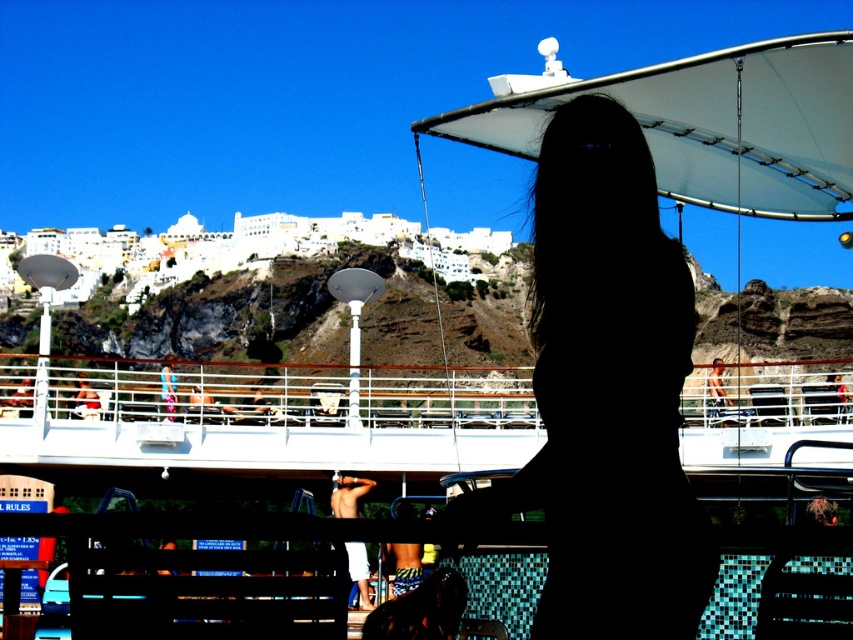
Is tan skin man at upper right bigger than pink fabric bikini at center?

Yes, tan skin man at upper right is bigger than pink fabric bikini at center.

Does tan skin man at upper right have a smaller size compared to pink fabric bikini at center?

No.

Where is `tan skin man at upper right`? This screenshot has height=640, width=853. tan skin man at upper right is located at coordinates (717, 394).

Is white matte canopy at upper center to the right of tan skin man at upper right from the viewer's perspective?

Incorrect, white matte canopy at upper center is not on the right side of tan skin man at upper right.

Does white matte canopy at upper center have a lesser height compared to tan skin man at upper right?

No.

Locate an element on the screen. Image resolution: width=853 pixels, height=640 pixels. white matte canopy at upper center is located at coordinates (704, 122).

Can you confirm if white matte canopy at upper center is bigger than yellow striped shorts at center?

Yes, white matte canopy at upper center is bigger than yellow striped shorts at center.

Identify the location of white matte canopy at upper center. (704, 122).